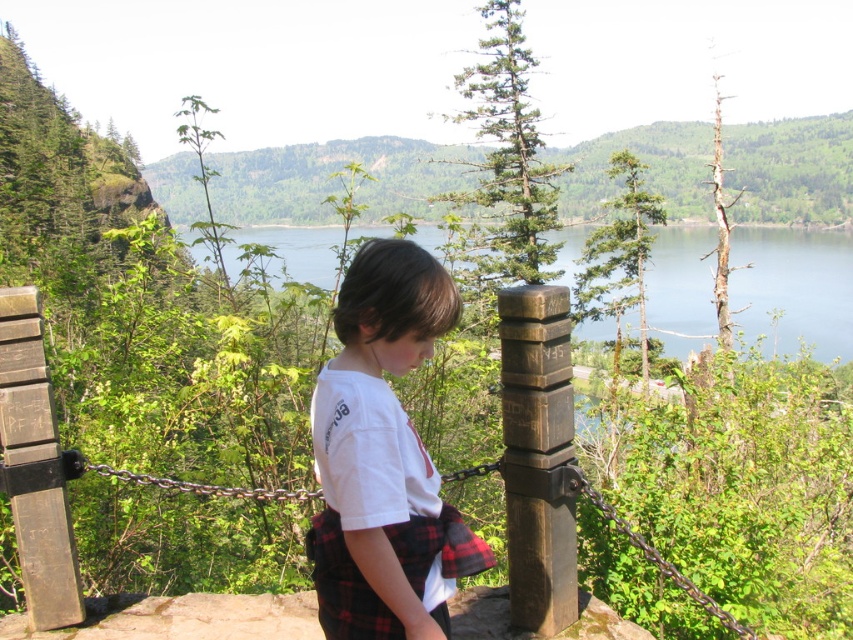
Question: Where is greenish-blue water at center located in relation to brown wood post at center in the image?

Choices:
 (A) below
 (B) above

Answer: (B)

Question: Is greenish-blue water at center bigger than brown wood post at center?

Choices:
 (A) no
 (B) yes

Answer: (B)

Question: Which point is closer to the camera?

Choices:
 (A) (469, 531)
 (B) (802, 330)

Answer: (A)

Question: Does greenish-blue water at center have a greater width compared to brown wood post at center?

Choices:
 (A) yes
 (B) no

Answer: (A)

Question: Among these objects, which one is farthest from the camera?

Choices:
 (A) greenish-blue water at center
 (B) white cotton shirt at center

Answer: (A)

Question: Based on their relative distances, which object is nearer to the brown wood post at center?

Choices:
 (A) white cotton shirt at center
 (B) greenish-blue water at center

Answer: (A)